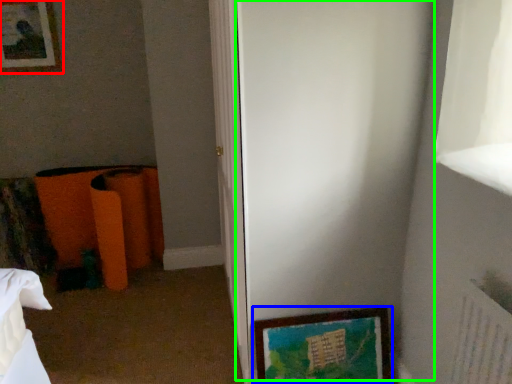
Question: Based on their relative distances, which object is farther from picture frame (highlighted by a red box)? Choose from picture frame (highlighted by a blue box) and screen door (highlighted by a green box).

Choices:
 (A) picture frame
 (B) screen door

Answer: (A)